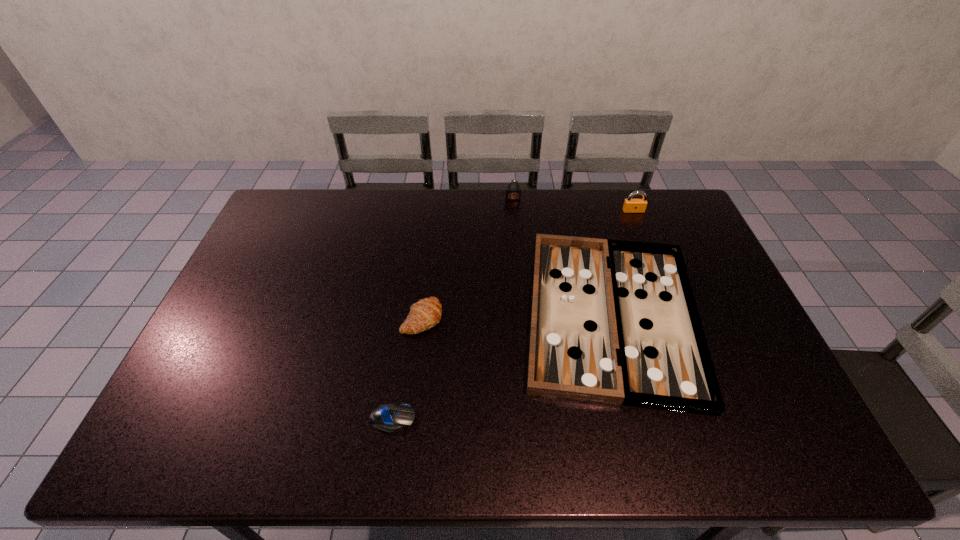
Image resolution: width=960 pixels, height=540 pixels. In the image, there is a desktop. In order to click on vacant space at the far left corner in this screenshot , I will do `click(299, 227)`.

Image resolution: width=960 pixels, height=540 pixels. I want to click on vacant region at the far right corner, so click(680, 213).

At what (x,y) coordinates should I click in order to perform the action: click on vacant point located between the farthest object and the nearer padlock. Please return your answer as a coordinate pair (x, y). Image resolution: width=960 pixels, height=540 pixels. Looking at the image, I should click on (573, 205).

Locate an element on the screen. free point between the nearer padlock and the crescent roll is located at coordinates (528, 265).

The height and width of the screenshot is (540, 960). I want to click on unoccupied area between the shortest object and the crescent roll, so click(x=407, y=368).

Where is `free point between the computer mouse and the fourth tallest object`? The height and width of the screenshot is (540, 960). free point between the computer mouse and the fourth tallest object is located at coordinates (502, 367).

Where is `vacant space in between the fourth tallest object and the shortest object`? This screenshot has width=960, height=540. vacant space in between the fourth tallest object and the shortest object is located at coordinates (502, 367).

Where is `vacant space in between the left padlock and the crescent roll`? The height and width of the screenshot is (540, 960). vacant space in between the left padlock and the crescent roll is located at coordinates (468, 258).

You are a GUI agent. You are given a task and a screenshot of the screen. Output one action in this format:
    pyautogui.click(x=<x>, y=<y>)
    Task: Click on the vacant region between the fourth tallest object and the shortest object
    This screenshot has height=540, width=960.
    Given the screenshot: What is the action you would take?
    point(502,367)

Locate an element on the screen. blank region between the crescent roll and the shortest object is located at coordinates (407, 368).